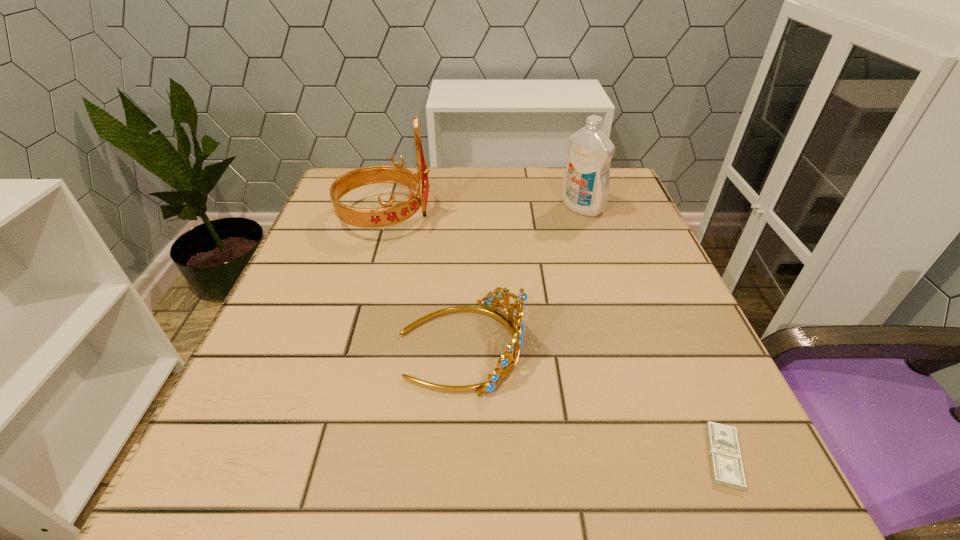
Where is `the taller tiara`? the taller tiara is located at coordinates (389, 214).

You are a GUI agent. You are given a task and a screenshot of the screen. Output one action in this format:
    pyautogui.click(x=<x>, y=<y>)
    Task: Click on the second object from right to left
    
    Given the screenshot: What is the action you would take?
    pyautogui.click(x=585, y=189)

I want to click on the second shortest object, so click(504, 366).

This screenshot has width=960, height=540. I want to click on the third farthest object, so click(x=504, y=366).

The width and height of the screenshot is (960, 540). In order to click on the nearest object in this screenshot , I will do `click(727, 469)`.

What are the coordinates of `money` in the screenshot? It's located at (727, 469).

Where is `free space located 0.100m on the front-facing side of the farther tiara`? This screenshot has width=960, height=540. free space located 0.100m on the front-facing side of the farther tiara is located at coordinates (476, 217).

The height and width of the screenshot is (540, 960). In order to click on vacant point located on the back of the second object from right to left in this screenshot , I will do 575,185.

Where is `free spot located 0.290m on the front-facing side of the nearer tiara`? free spot located 0.290m on the front-facing side of the nearer tiara is located at coordinates (698, 346).

This screenshot has width=960, height=540. Find the location of `vacant space situated 0.220m on the back of the rightmost object`. vacant space situated 0.220m on the back of the rightmost object is located at coordinates (662, 314).